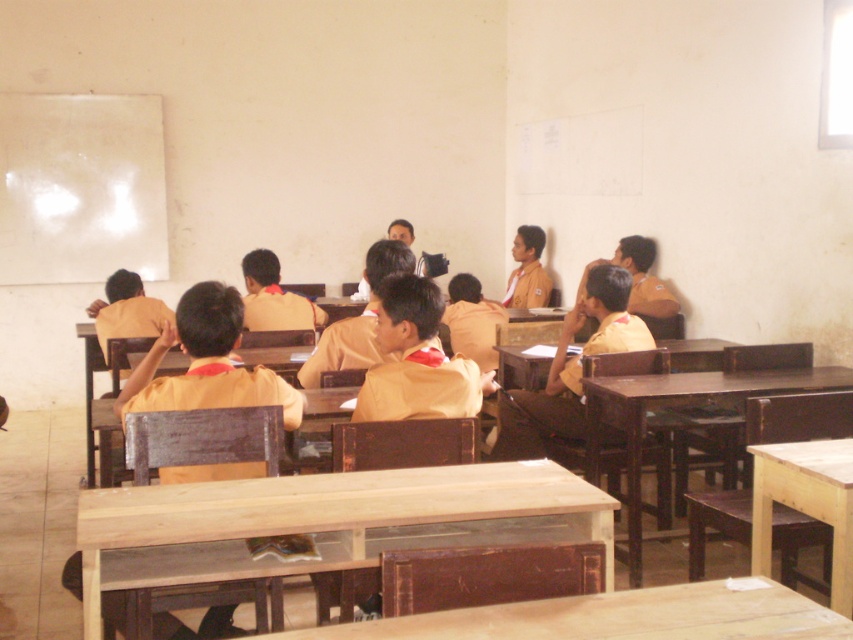
Can you confirm if light brown wooden table at lower center is bigger than brown wooden table at center?

No.

Does light brown wooden table at lower center have a lesser width compared to brown wooden table at center?

No.

Is point (352, 636) positioned behind point (668, 353)?

That is False.

Where is `light brown wooden table at lower center`? The image size is (853, 640). light brown wooden table at lower center is located at coordinates (614, 616).

Is wooden table at center smaller than brown wooden table at center?

Actually, wooden table at center might be larger than brown wooden table at center.

Which is above, wooden table at center or brown wooden table at center?

brown wooden table at center

Does point (589, 472) lie behind point (500, 346)?

No, (589, 472) is in front of (500, 346).

Find the location of `wooden table at center`. wooden table at center is located at coordinates (679, 403).

Looking at this image, can you confirm if light brown wooden table at center is shorter than matte yellow shirt at center?

Indeed, light brown wooden table at center has a lesser height compared to matte yellow shirt at center.

Does light brown wooden table at center appear under matte yellow shirt at center?

Correct, light brown wooden table at center is located below matte yellow shirt at center.

The width and height of the screenshot is (853, 640). I want to click on light brown wooden table at center, so click(x=328, y=509).